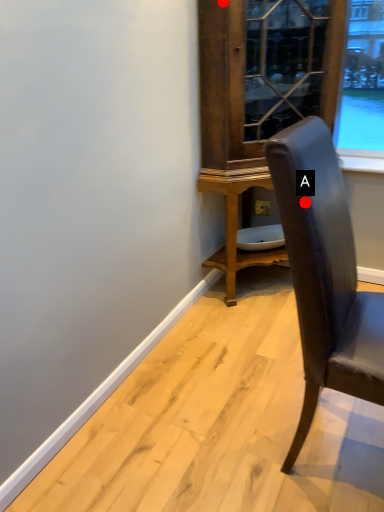
Question: Two points are circled on the image, labeled by A and B beside each circle. Which point is closer to the camera?

Choices:
 (A) A is closer
 (B) B is closer

Answer: (A)